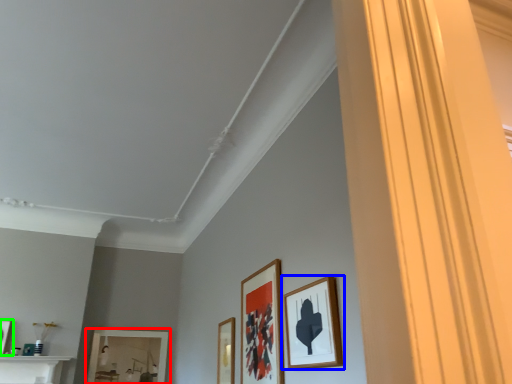
Question: Estimate the real-world distances between objects in this image. Which object is farther from picture frame (highlighted by a red box), picture frame (highlighted by a blue box) or picture frame (highlighted by a green box)?

Choices:
 (A) picture frame
 (B) picture frame

Answer: (A)